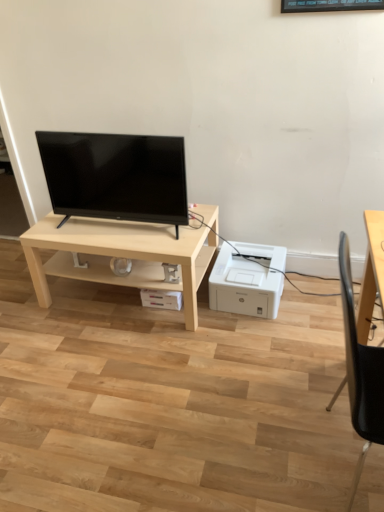
Question: Could you tell me if black glossy tv at center is facing white plastic printer at lower right?

Choices:
 (A) no
 (B) yes

Answer: (A)

Question: From the image's perspective, would you say black glossy tv at center is positioned over white plastic printer at lower right?

Choices:
 (A) no
 (B) yes

Answer: (B)

Question: Does black glossy tv at center have a smaller size compared to white plastic printer at lower right?

Choices:
 (A) yes
 (B) no

Answer: (B)

Question: Considering the relative sizes of black glossy tv at center and white plastic printer at lower right in the image provided, is black glossy tv at center taller than white plastic printer at lower right?

Choices:
 (A) yes
 (B) no

Answer: (A)

Question: Considering the relative sizes of black glossy tv at center and white plastic printer at lower right in the image provided, is black glossy tv at center bigger than white plastic printer at lower right?

Choices:
 (A) yes
 (B) no

Answer: (A)

Question: Is black glossy tv at center far from white plastic printer at lower right?

Choices:
 (A) no
 (B) yes

Answer: (A)

Question: Is white plastic printer at lower right oriented towards black plastic chair at right?

Choices:
 (A) yes
 (B) no

Answer: (B)

Question: Is white plastic printer at lower right smaller than black plastic chair at right?

Choices:
 (A) yes
 (B) no

Answer: (A)

Question: Would you consider white plastic printer at lower right to be distant from black plastic chair at right?

Choices:
 (A) yes
 (B) no

Answer: (B)

Question: Can you confirm if white plastic printer at lower right is bigger than black plastic chair at right?

Choices:
 (A) no
 (B) yes

Answer: (A)

Question: Can you confirm if white plastic printer at lower right is taller than black plastic chair at right?

Choices:
 (A) yes
 (B) no

Answer: (B)

Question: From the image's perspective, would you say white plastic printer at lower right is shown under black plastic chair at right?

Choices:
 (A) yes
 (B) no

Answer: (B)

Question: Is black plastic chair at right in front of light wood table at center?

Choices:
 (A) yes
 (B) no

Answer: (A)